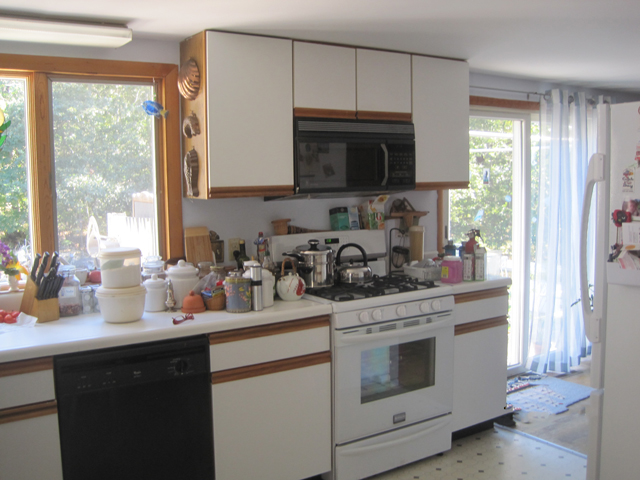
Find the location of a particular element. microwave is located at coordinates (356, 160).